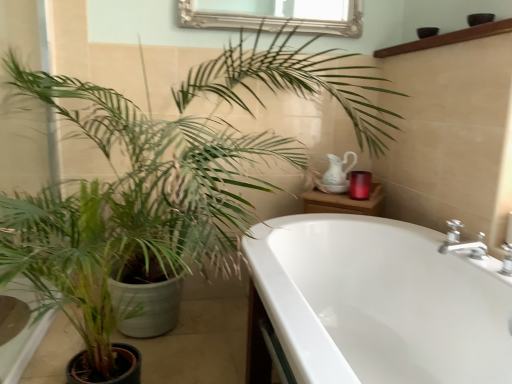
The image size is (512, 384). What are the coordinates of `green matte plant at left` in the screenshot? It's located at (66, 264).

I want to click on green matte plant at left, so click(66, 264).

Which object is closer to the camera taking this photo, white glossy bathtub at lower right or green matte plant at left?

white glossy bathtub at lower right is more forward.

Which of these two, white glossy bathtub at lower right or green matte plant at left, is wider?

With larger width is white glossy bathtub at lower right.

Is point (490, 377) closer to viewer compared to point (97, 324)?

Yes, it is.

Is green matte plant at left a part of white glossy bathtub at lower right?

No, white glossy bathtub at lower right does not contain green matte plant at left.

From their relative heights in the image, would you say green matte plant at left is taller or shorter than brown wooden balustrade at upper right?

green matte plant at left is taller than brown wooden balustrade at upper right.

From a real-world perspective, which is physically below, green matte plant at left or brown wooden balustrade at upper right?

green matte plant at left.

Image resolution: width=512 pixels, height=384 pixels. In order to click on houseplant beneath the brown wooden balustrade at upper right (from a real-world perspective) in this screenshot , I will do `click(66, 264)`.

Is green matte plant at left outside of white glossy bathtub at lower right?

That's correct, green matte plant at left is outside of white glossy bathtub at lower right.

Is green matte plant at left smaller than white glossy bathtub at lower right?

Yes, green matte plant at left is smaller than white glossy bathtub at lower right.

In the scene shown: What's the angular difference between green matte plant at left and white glossy bathtub at lower right's facing directions?

There is a 86.6-degree angle between the facing directions of green matte plant at left and white glossy bathtub at lower right.

From the image's perspective, does green matte plant at left appear higher than white glossy bathtub at lower right?

Correct, green matte plant at left appears higher than white glossy bathtub at lower right in the image.

From the image's perspective, between brown wooden balustrade at upper right and green matte plant at left, which one is located above?

brown wooden balustrade at upper right, from the image's perspective.

Does brown wooden balustrade at upper right have a larger size compared to green matte plant at left?

Incorrect, brown wooden balustrade at upper right is not larger than green matte plant at left.

Considering the points (344, 318) and (478, 28), which point is in front, point (344, 318) or point (478, 28)?

The point (478, 28) is closer.

From the picture: Considering the relative sizes of white glossy bathtub at lower right and brown wooden balustrade at upper right in the image provided, is white glossy bathtub at lower right taller than brown wooden balustrade at upper right?

Yes, white glossy bathtub at lower right is taller than brown wooden balustrade at upper right.

Is point (463, 35) closer or farther from the camera than point (421, 295)?

Point (463, 35) appears to be closer to the viewer than point (421, 295).

Which is more to the right, brown wooden balustrade at upper right or white glossy bathtub at lower right?

Positioned to the right is brown wooden balustrade at upper right.

Is brown wooden balustrade at upper right surrounding white glossy bathtub at lower right?

No.

Where is `bathtub that appears below the green matte plant at left (from a real-world perspective)`? bathtub that appears below the green matte plant at left (from a real-world perspective) is located at coordinates (379, 302).

Find the location of a particular element. This screenshot has width=512, height=384. houseplant that is below the brown wooden balustrade at upper right (from the image's perspective) is located at coordinates (66, 264).

When comparing their distances from brown wooden balustrade at upper right, does white glossy bathtub at lower right or green matte plant at left seem closer?

white glossy bathtub at lower right lies closer to brown wooden balustrade at upper right than the other object.

From the image, which object appears to be farther from green matte plant at left, brown wooden balustrade at upper right or white glossy bathtub at lower right?

Among the two, brown wooden balustrade at upper right is located further to green matte plant at left.

Looking at this image, looking at the image, which one is located further to green matte plant at left, white glossy bathtub at lower right or brown wooden balustrade at upper right?

Among the two, brown wooden balustrade at upper right is located further to green matte plant at left.

Looking at the image, which one is located closer to brown wooden balustrade at upper right, green matte plant at left or white glossy bathtub at lower right?

white glossy bathtub at lower right.

Looking at the image, which one is located closer to white glossy bathtub at lower right, green matte plant at left or brown wooden balustrade at upper right?

green matte plant at left lies closer to white glossy bathtub at lower right than the other object.

When comparing their distances from white glossy bathtub at lower right, does brown wooden balustrade at upper right or green matte plant at left seem closer?

green matte plant at left.

In order to click on bathtub located between green matte plant at left and brown wooden balustrade at upper right in the left-right direction in this screenshot , I will do `click(379, 302)`.